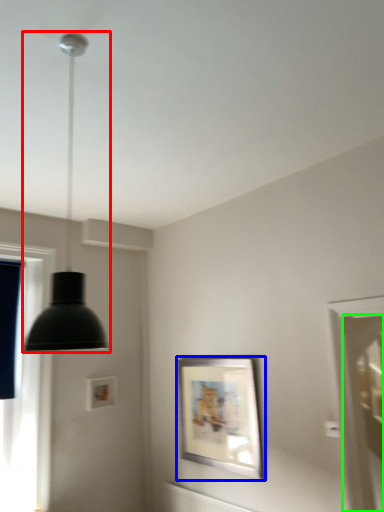
Question: Which object is the closest to the lamp (highlighted by a red box)? Choose among these: picture frame (highlighted by a blue box) or screen door (highlighted by a green box).

Choices:
 (A) picture frame
 (B) screen door

Answer: (A)